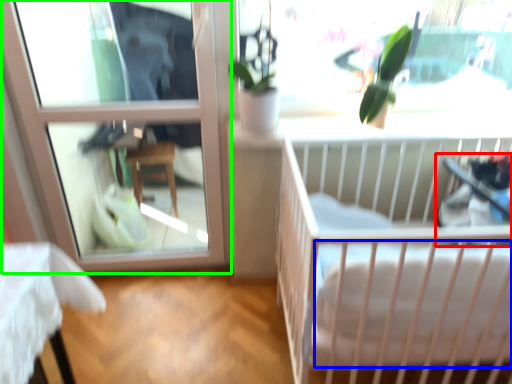
Question: Based on their relative distances, which object is nearer to baby carriage (highlighted by a red box)? Choose from mattress (highlighted by a blue box) and window (highlighted by a green box).

Choices:
 (A) mattress
 (B) window

Answer: (A)